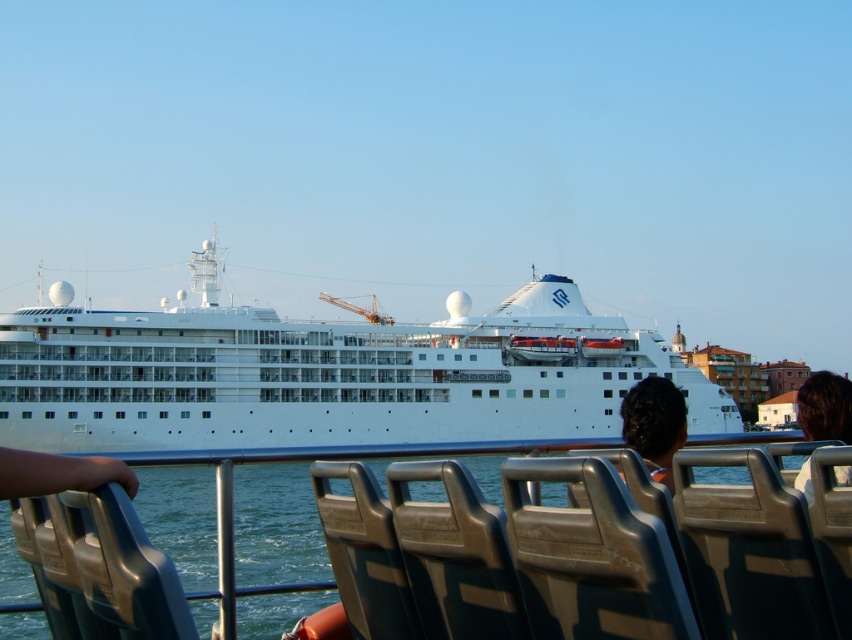
Does white glossy cruise ship at center have a larger size compared to gray plastic chair at center?

Correct, white glossy cruise ship at center is larger in size than gray plastic chair at center.

Between point (366, 346) and point (623, 593), which one is positioned in front?

Point (623, 593) is in front.

Locate an element on the screen. The height and width of the screenshot is (640, 852). white glossy cruise ship at center is located at coordinates (326, 372).

Does matte gray seat at center have a larger size compared to dark brown hair at upper right?

Incorrect, matte gray seat at center is not larger than dark brown hair at upper right.

Who is lower down, matte gray seat at center or dark brown hair at upper right?

matte gray seat at center is below.

Is point (507, 632) less distant than point (845, 388)?

Yes.

Locate an element on the screen. The width and height of the screenshot is (852, 640). matte gray seat at center is located at coordinates (455, 556).

Between point (629, 580) and point (809, 461), which one is positioned behind?

Positioned behind is point (809, 461).

Who is positioned more to the left, gray plastic chair at center or dark brown hair at upper right?

From the viewer's perspective, gray plastic chair at center appears more on the left side.

Is point (593, 627) positioned after point (804, 384)?

No, (593, 627) is in front of (804, 384).

The width and height of the screenshot is (852, 640). Identify the location of gray plastic chair at center. (591, 557).